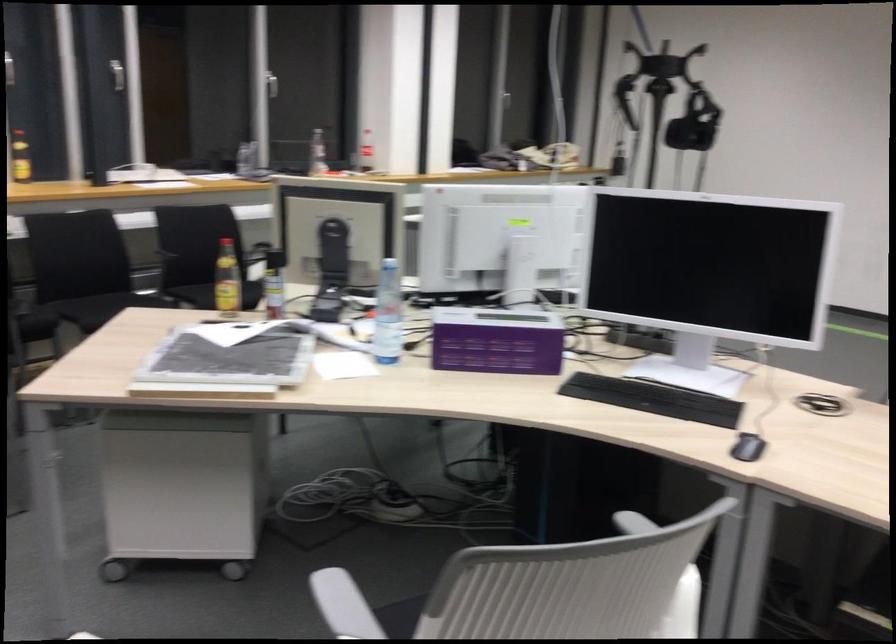
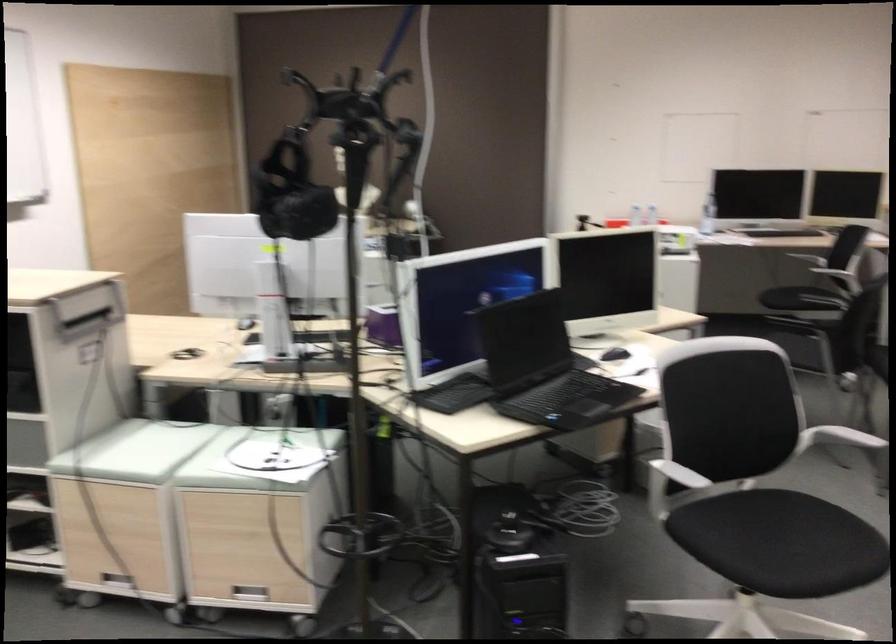
Question: I am providing you with two images of the same scene from different viewpoints. After the viewpoint changes to image2, which objects are now occluded?

Choices:
 (A) white chair armrest
 (B) metal drawer handle
 (C) black computer mouse
 (D) clear snack bowl

Answer: (A)